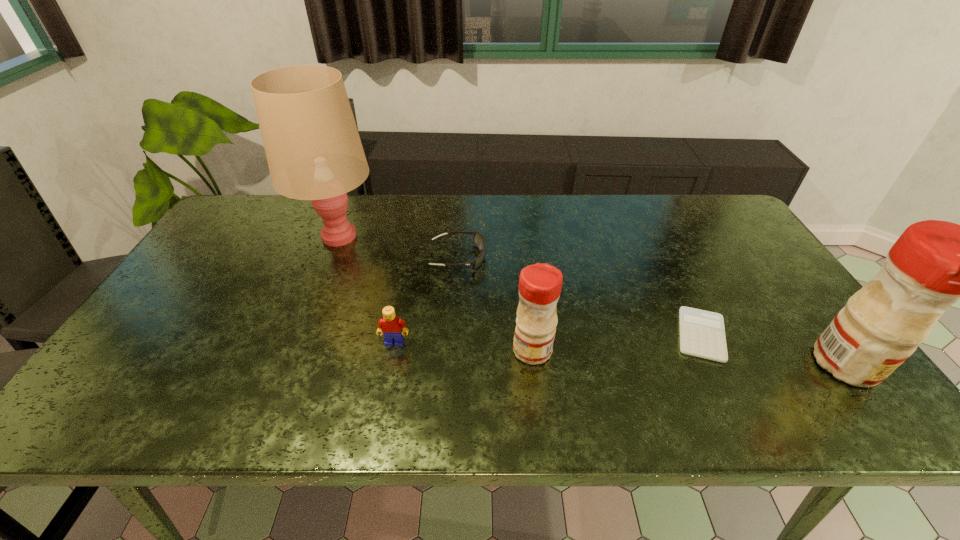
Locate an element on the screen. This screenshot has height=540, width=960. object located at the right edge is located at coordinates (933, 264).

The width and height of the screenshot is (960, 540). What are the coordinates of `object at the near right corner` in the screenshot? It's located at (933, 264).

Image resolution: width=960 pixels, height=540 pixels. Find the location of `vacant position at the far edge of the desktop`. vacant position at the far edge of the desktop is located at coordinates click(x=269, y=231).

This screenshot has height=540, width=960. In order to click on free space at the near edge of the desktop in this screenshot , I will do `click(604, 382)`.

Locate an element on the screen. The image size is (960, 540). free space at the left edge of the desktop is located at coordinates (176, 327).

I want to click on vacant region at the right edge of the desktop, so click(757, 304).

Find the location of a particular element. The width and height of the screenshot is (960, 540). free space at the far left corner of the desktop is located at coordinates (255, 212).

I want to click on vacant space at the near right corner of the desktop, so click(x=837, y=382).

Find the location of a particular element. Image resolution: width=960 pixels, height=540 pixels. free spot between the shorter condiment and the fifth shortest object is located at coordinates (689, 357).

At what (x,y) coordinates should I click in order to perform the action: click on free point between the fifth tallest object and the second tallest object. Please return your answer as a coordinate pair (x, y). The image size is (960, 540). Looking at the image, I should click on (652, 311).